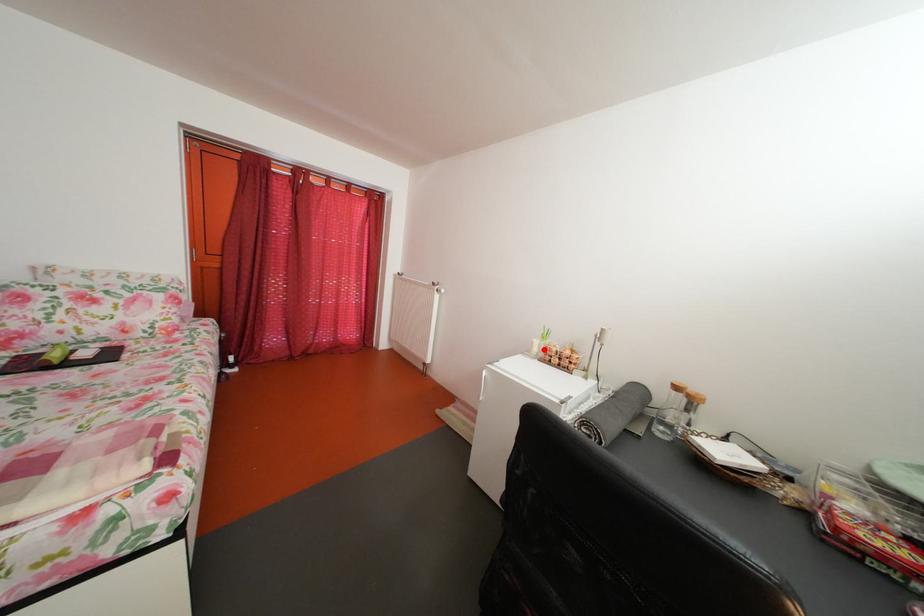
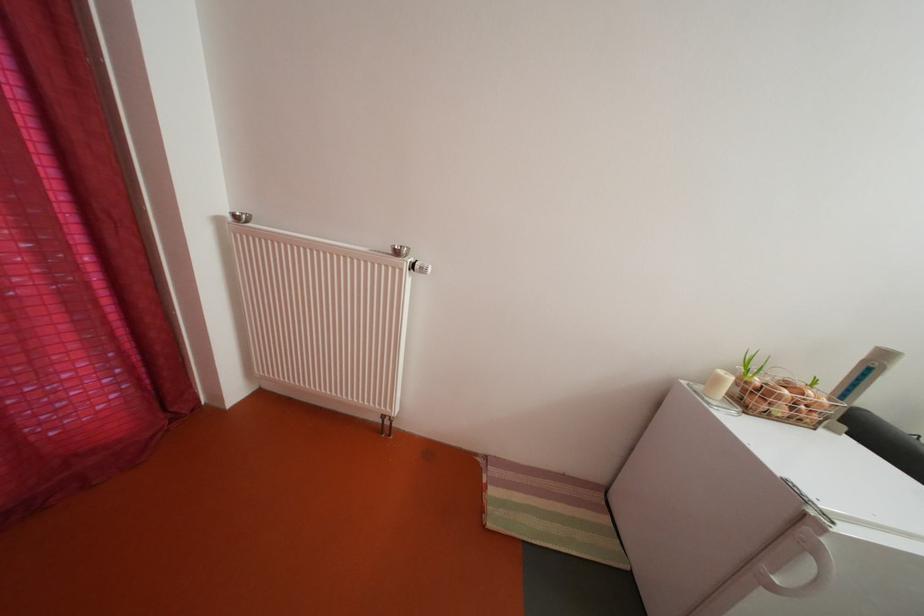
Where in the second image is the point corresponding to the highlighted location from the first image?

(728, 386)